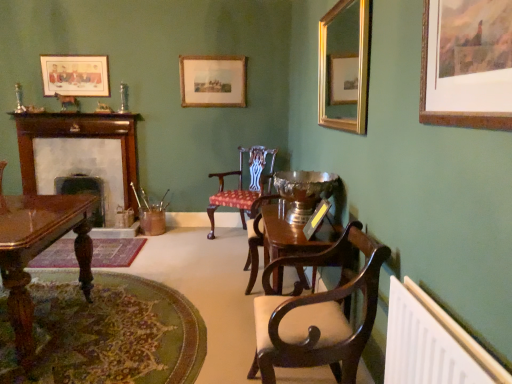
Question: Should I look upward or downward to see wooden fireplace at left, acting as the 1th fireplace starting from the right?

Choices:
 (A) up
 (B) down

Answer: (A)

Question: Can you confirm if matte wooden picture frame at upper left, the second picture frame when ordered from back to front, is thinner than mahogany polished desk at lower left?

Choices:
 (A) no
 (B) yes

Answer: (B)

Question: Is matte wooden picture frame at upper left, which ranks as the 3th picture frame in front-to-back order, bigger than mahogany polished desk at lower left?

Choices:
 (A) no
 (B) yes

Answer: (A)

Question: Is matte wooden picture frame at upper left, the 4th picture frame when ordered from right to left, at the right side of mahogany polished desk at lower left?

Choices:
 (A) no
 (B) yes

Answer: (A)

Question: Does matte wooden picture frame at upper left, which ranks as the 3th picture frame in front-to-back order, lie in front of mahogany polished desk at lower left?

Choices:
 (A) no
 (B) yes

Answer: (A)

Question: Is mahogany polished desk at lower left completely or partially inside matte wooden picture frame at upper left, which is the 1th picture frame in left-to-right order?

Choices:
 (A) yes
 (B) no

Answer: (B)

Question: Is matte wooden picture frame at upper left, the 4th picture frame when ordered from right to left, far from mahogany polished desk at lower left?

Choices:
 (A) yes
 (B) no

Answer: (A)

Question: Can we say gold-framed painting at upper right, which is counted as the first picture frame, starting from the front, lies outside mahogany wood chair at center, arranged as the 2th chair when viewed from the back?

Choices:
 (A) no
 (B) yes

Answer: (B)

Question: Considering the relative sizes of gold-framed painting at upper right, which is counted as the first picture frame, starting from the front, and mahogany wood chair at center, the first chair positioned from the front, in the image provided, is gold-framed painting at upper right, which is counted as the first picture frame, starting from the front, wider than mahogany wood chair at center, the first chair positioned from the front,?

Choices:
 (A) yes
 (B) no

Answer: (B)

Question: From the image's perspective, does gold-framed painting at upper right, the 4th picture frame viewed from the left, appear higher than mahogany wood chair at center, the first chair positioned from the front?

Choices:
 (A) no
 (B) yes

Answer: (B)

Question: From a real-world perspective, is gold-framed painting at upper right, which is counted as the first picture frame, starting from the front, located higher than mahogany wood chair at center, the first chair positioned from the front?

Choices:
 (A) no
 (B) yes

Answer: (B)

Question: Considering the relative positions of gold-framed painting at upper right, which is counted as the first picture frame, starting from the front, and mahogany wood chair at center, the first chair positioned from the front, in the image provided, is gold-framed painting at upper right, which is counted as the first picture frame, starting from the front, to the right of mahogany wood chair at center, the first chair positioned from the front, from the viewer's perspective?

Choices:
 (A) yes
 (B) no

Answer: (A)

Question: Could you tell me if gold-framed painting at upper right, the first picture frame from the right, is facing mahogany wood chair at center, the first chair positioned from the front?

Choices:
 (A) yes
 (B) no

Answer: (B)

Question: From a real-world perspective, does mahogany polished desk at lower left stand above gold-framed mirror at upper right, arranged as the second picture frame when viewed from the right?

Choices:
 (A) no
 (B) yes

Answer: (A)